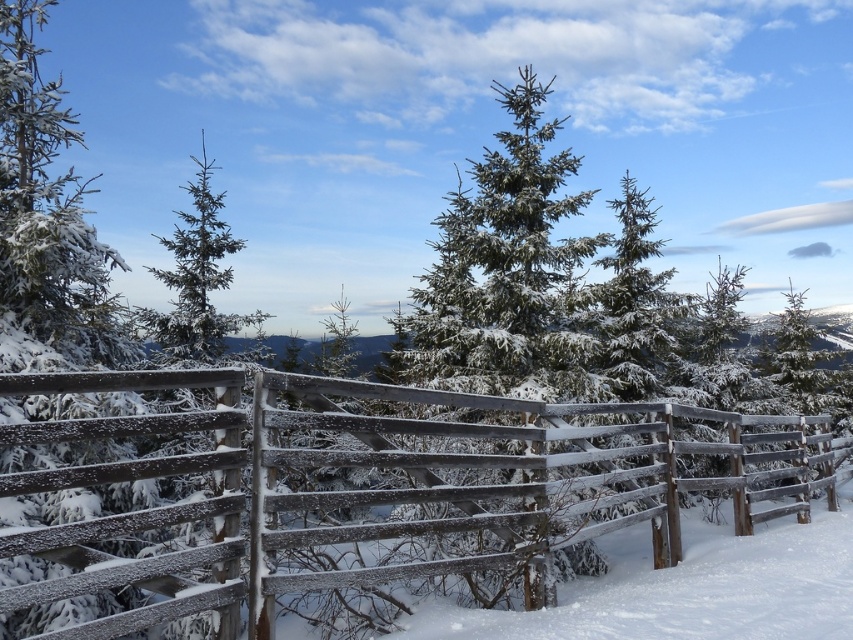
Who is more distant from viewer, (320, 532) or (219, 349)?

The point (219, 349) is more distant.

Can you confirm if frosted wood fence at center is smaller than green matte tree at upper left?

Correct, frosted wood fence at center occupies less space than green matte tree at upper left.

Is point (376, 580) positioned behind point (187, 259)?

No, (376, 580) is closer to viewer.

This screenshot has width=853, height=640. I want to click on frosted wood fence at center, so click(x=393, y=488).